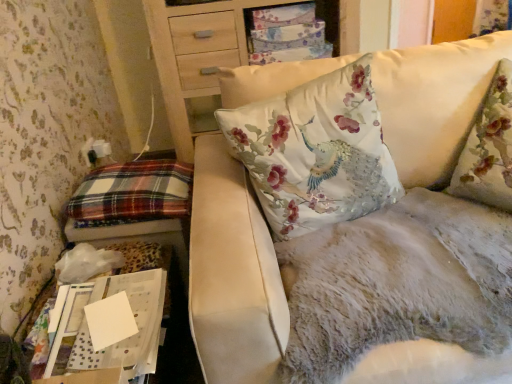
Question: In the image, is floral fabric cushion at upper center positioned in front of or behind plaid fabric pillow at left?

Choices:
 (A) front
 (B) behind

Answer: (B)

Question: Which is correct: floral fabric cushion at upper center is inside plaid fabric pillow at left, or outside of it?

Choices:
 (A) outside
 (B) inside

Answer: (A)

Question: Which is farther from the plaid fabric pillow at left?

Choices:
 (A) fluffy white couch at upper right
 (B) floral fabric cushion at upper center
 (C) white paper at lower left

Answer: (B)

Question: Which object is the farthest from the white paper at lower left?

Choices:
 (A) floral fabric cushion at upper center
 (B) plaid fabric pillow at left
 (C) fluffy white couch at upper right

Answer: (A)